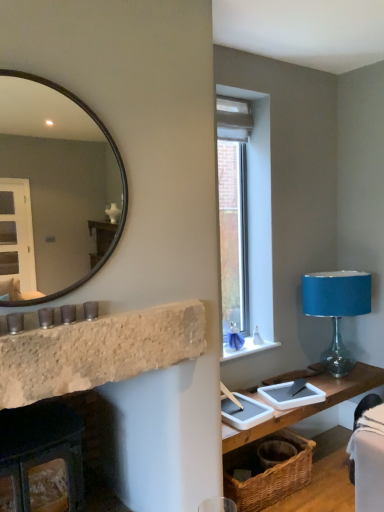
Locate an element on the screen. This screenshot has height=512, width=384. empty space that is ontop of white stone window sill at center (from a real-world perspective) is located at coordinates (242, 345).